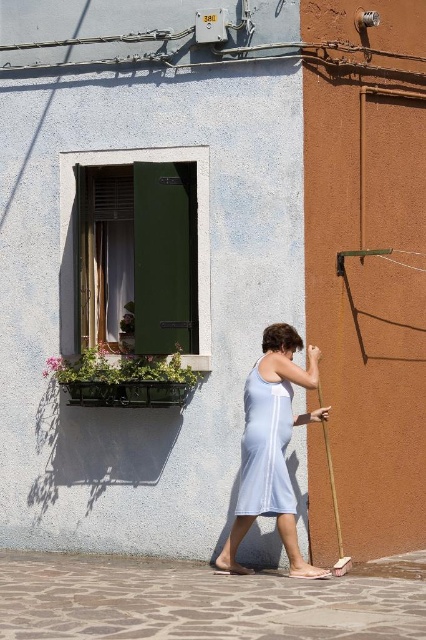
You are standing at the entrance of the town square and want to find the green matte door at upper left. According to the scene description, where should you look relative to the white building with green shutters?

The green matte door at upper left is located at point coordinates (196, 227), which would be to the upper left relative to the white building with green shutters.